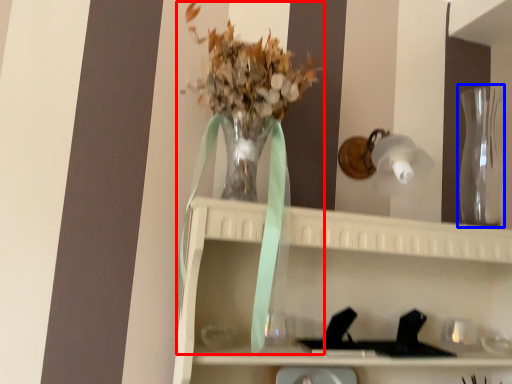
Question: Which of the following is the closest to the observer, floral arrangement (highlighted by a red box) or glass vase (highlighted by a blue box)?

Choices:
 (A) floral arrangement
 (B) glass vase

Answer: (A)